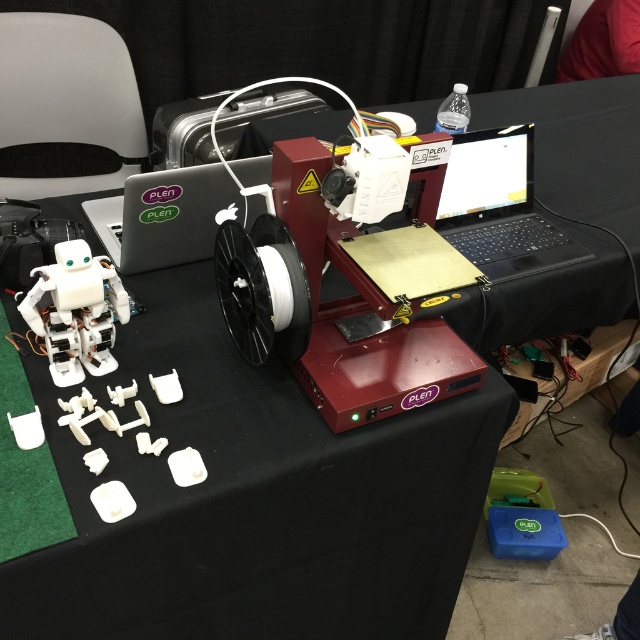
Does matte black laptop at upper right have a smaller size compared to satin black laptop at center?

Indeed, matte black laptop at upper right has a smaller size compared to satin black laptop at center.

Locate an element on the screen. matte black laptop at upper right is located at coordinates (499, 205).

Does matte black laptop at upper right appear on the right side of white plastic robot at lower left?

Indeed, matte black laptop at upper right is positioned on the right side of white plastic robot at lower left.

Based on the photo, which is above, matte black laptop at upper right or white plastic robot at lower left?

matte black laptop at upper right

Between point (456, 198) and point (54, 364), which one is positioned in front?

Point (54, 364) is more forward.

Find the location of a particular element. The image size is (640, 640). matte black laptop at upper right is located at coordinates (499, 205).

Measure the distance between satin black laptop at center and camera.

satin black laptop at center is 1.01 meters from camera.

Is satin black laptop at center above white plastic robot at lower left?

Correct, satin black laptop at center is located above white plastic robot at lower left.

Who is more distant from viewer, (x=188, y=232) or (x=93, y=340)?

Point (x=188, y=232)

The height and width of the screenshot is (640, 640). I want to click on satin black laptop at center, so click(163, 216).